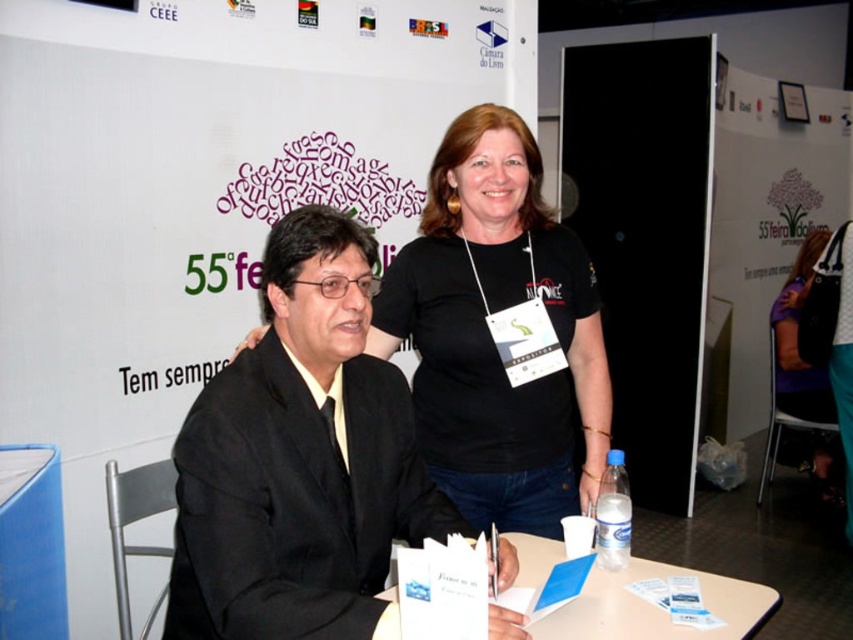
You are a photographer at the event and need to position a light source to ensure both the black suit at left and the woman in the black t shirt are well lit. Given the light source can only be placed at either the left or right side of the image, which side should you choose to evenly illuminate both subjects?

The black suit at left is located at point (300, 460). Since the woman in the black t shirt is positioned to the right of the black suit at left, placing the light source on the right side would help evenly illuminate both subjects.

You are organizing a photo shoot and need to ensure that the black suit at left and the clear plastic bottle at table right fit within a 1.2 meter wide frame. Given their sizes, will both items fit side by side?

The black suit at left is wider than the clear plastic bottle at table right. Since the total width of both items combined would exceed 1.2 meters, they cannot fit side by side within the frame.